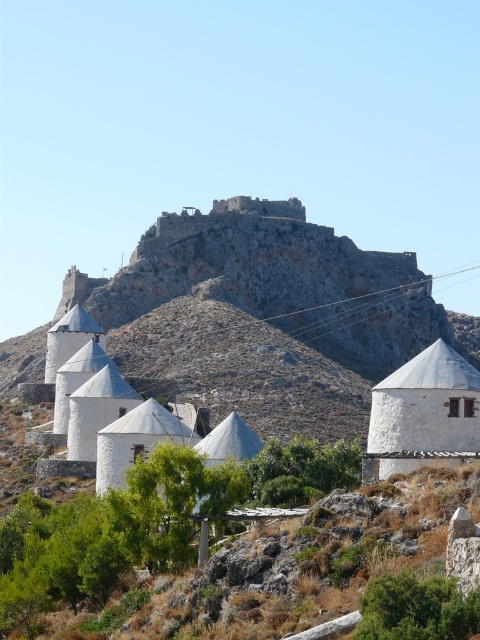
Question: Which point is closer to the camera?

Choices:
 (A) white matte chapel at lower right
 (B) rustic stone castle at upper center

Answer: (A)

Question: Is rustic stone castle at upper center closer to camera compared to white matte chapel at lower right?

Choices:
 (A) no
 (B) yes

Answer: (A)

Question: Can you confirm if rustic stone castle at upper center is thinner than white matte chapel at lower right?

Choices:
 (A) yes
 (B) no

Answer: (B)

Question: Which of the following is the farthest from the observer?

Choices:
 (A) (278, 208)
 (B) (446, 394)

Answer: (A)

Question: Can you confirm if rustic stone castle at upper center is positioned to the left of white matte chapel at lower right?

Choices:
 (A) yes
 (B) no

Answer: (A)